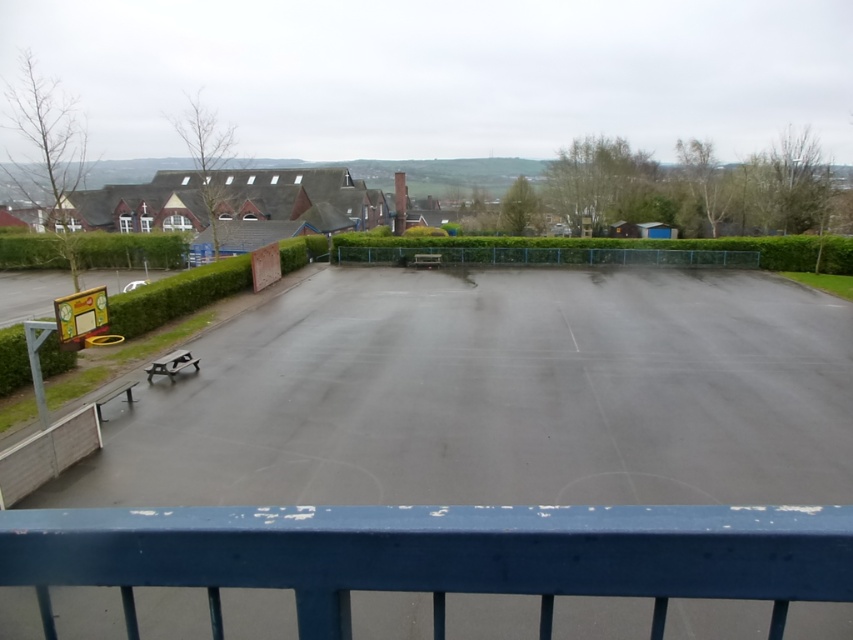
Question: Can you confirm if smooth asphalt skate park at center is wider than green leafy hedge at left?

Choices:
 (A) no
 (B) yes

Answer: (B)

Question: Can you confirm if smooth asphalt skate park at center is positioned to the left of smooth blue railing at center?

Choices:
 (A) yes
 (B) no

Answer: (B)

Question: Which of these objects is positioned closest to the smooth blue railing at center?

Choices:
 (A) smooth asphalt skate park at center
 (B) green leafy hedge at left

Answer: (A)

Question: Which point is closer to the camera taking this photo?

Choices:
 (A) [x=91, y=244]
 (B) [x=393, y=602]
 (C) [x=851, y=554]

Answer: (C)

Question: Is the position of smooth asphalt skate park at center more distant than that of smooth blue railing at center?

Choices:
 (A) no
 (B) yes

Answer: (B)

Question: Which of the following is the farthest from the observer?

Choices:
 (A) smooth blue railing at center
 (B) smooth asphalt skate park at center
 (C) green leafy hedge at left

Answer: (C)